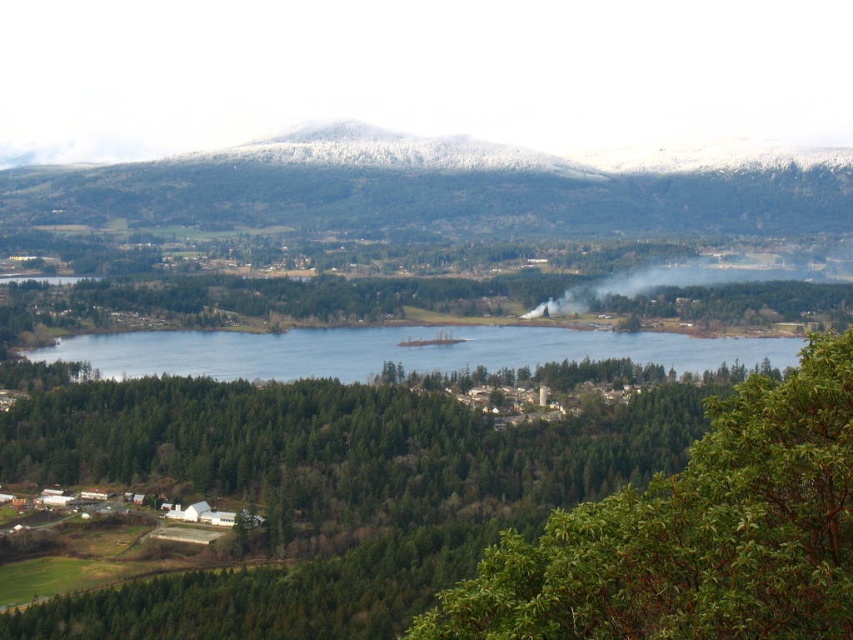
You are standing in the forest looking towards the lake. You see a green leafy tree at center and a blue water at center. Which object is closer to you?

The green leafy tree at center is closer to you because it is in front of the blue water at center.

From the picture: You are a hiker planning to cross the blue water at center using a small raft. The raft can only support objects with a width of 1 meter. Based on the scene, can the raft safely carry the green leafy tree at center?

The green leafy tree at center has a lesser width compared to blue water at center. Since the blue water at center is wider, the green leafy tree at center is narrower than the water. The raft can support objects up to 1 meter wide. Therefore, if the tree is narrower than 1 meter, it can be safely carried. However, without exact measurements, we can infer that since the tree is narrower than the water, which is a large body, it is likely within the raft capacity. Thus, the raft can safely carry the green le

You are a hiker standing at the edge of the forest looking towards the green leafy tree at center and the blue water at center. Which object appears taller from your perspective?

The green leafy tree at center appears taller than the blue water at center because it has a greater height compared to the blue water at center.